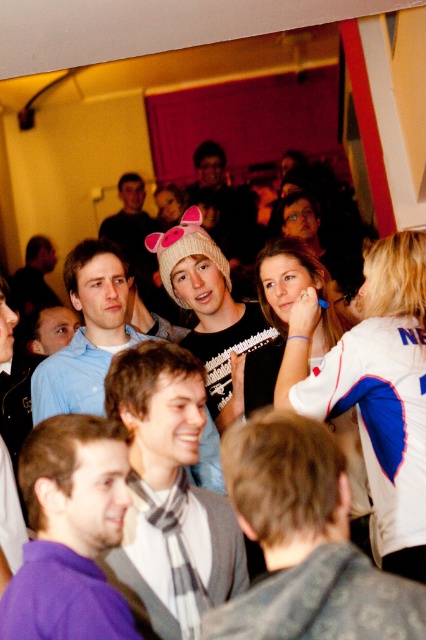
Question: Estimate the real-world distances between objects in this image. Which object is farther from the matte blue shirt at center?

Choices:
 (A) gray scarf at center
 (B) gray sweater at center
 (C) purple fabric at center

Answer: (B)

Question: Which of the following is the closest to the observer?

Choices:
 (A) white knit hat at center
 (B) gray scarf at center
 (C) purple fabric at center
 (D) gray sweater at center

Answer: (D)

Question: Based on their relative distances, which object is nearer to the gray sweater at center?

Choices:
 (A) gray scarf at center
 (B) purple fabric at center
 (C) white knit hat at center

Answer: (B)

Question: Is gray sweater at center to the right of matte blue shirt at center from the viewer's perspective?

Choices:
 (A) yes
 (B) no

Answer: (A)

Question: Can you confirm if gray sweater at center is positioned above matte blue shirt at center?

Choices:
 (A) yes
 (B) no

Answer: (B)

Question: Where is gray scarf at center located in relation to white knit hat at center in the image?

Choices:
 (A) left
 (B) right

Answer: (A)